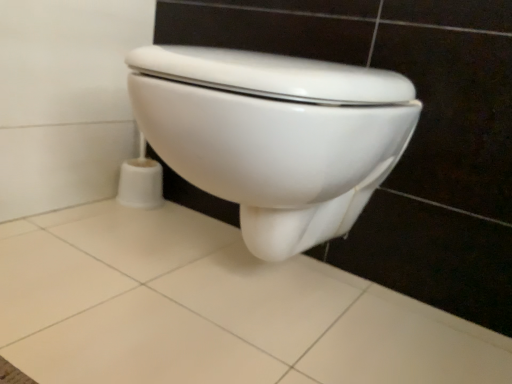
Question: Is white glossy toilet at center surrounding white ceramic tile at lower center?

Choices:
 (A) no
 (B) yes

Answer: (A)

Question: Does white glossy toilet at center have a smaller size compared to white ceramic tile at lower center?

Choices:
 (A) no
 (B) yes

Answer: (A)

Question: From a real-world perspective, does white glossy toilet at center stand above white ceramic tile at lower center?

Choices:
 (A) no
 (B) yes

Answer: (B)

Question: Is white glossy toilet at center in contact with white ceramic tile at lower center?

Choices:
 (A) no
 (B) yes

Answer: (A)

Question: Does white glossy toilet at center come in front of white ceramic tile at lower center?

Choices:
 (A) no
 (B) yes

Answer: (A)

Question: From the image's perspective, is white glossy toilet at center located beneath white ceramic tile at lower center?

Choices:
 (A) yes
 (B) no

Answer: (B)

Question: Is white ceramic tile at lower center facing away from white glossy toilet at center?

Choices:
 (A) no
 (B) yes

Answer: (A)

Question: Can you confirm if white ceramic tile at lower center is shorter than white glossy toilet at center?

Choices:
 (A) yes
 (B) no

Answer: (A)

Question: From the image's perspective, is white ceramic tile at lower center located above white glossy toilet at center?

Choices:
 (A) yes
 (B) no

Answer: (B)

Question: Is white ceramic tile at lower center positioned before white glossy toilet at center?

Choices:
 (A) yes
 (B) no

Answer: (A)

Question: Can you confirm if white ceramic tile at lower center is thinner than white glossy toilet at center?

Choices:
 (A) no
 (B) yes

Answer: (A)

Question: Does white ceramic tile at lower center have a larger size compared to white glossy toilet at center?

Choices:
 (A) yes
 (B) no

Answer: (B)

Question: Considering their positions, is white glossy toilet at center located in front of or behind white ceramic tile at lower center?

Choices:
 (A) behind
 (B) front

Answer: (A)